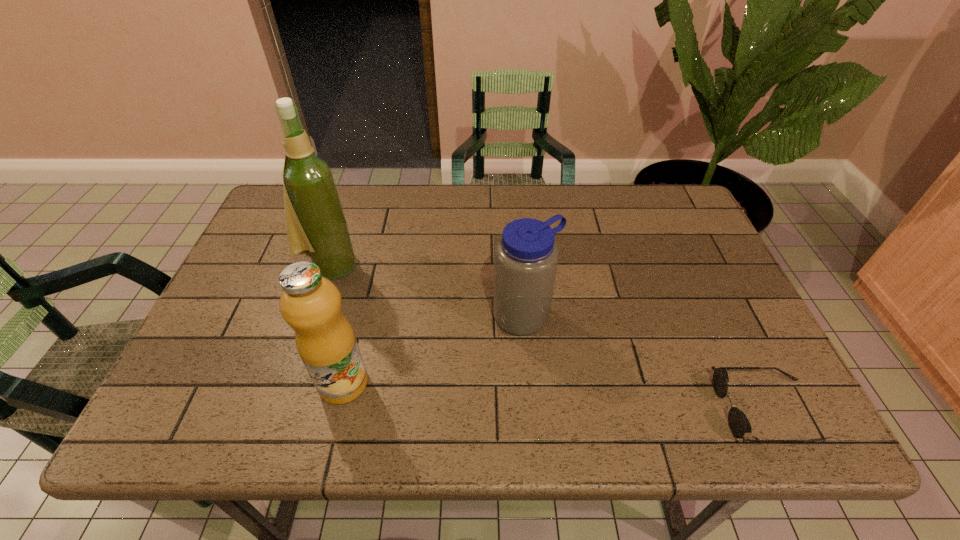
Identify the location of free spot on the desktop that is between the third shortest object and the shortest object and is positioned with a carrying loop on the side of the third tallest object. The width and height of the screenshot is (960, 540). (595, 399).

Find the location of a particular element. Image resolution: width=960 pixels, height=540 pixels. free space on the desktop that is between the fruit juice and the rightmost object and is positioned on the front-facing side of the wine bottle is located at coordinates (553, 396).